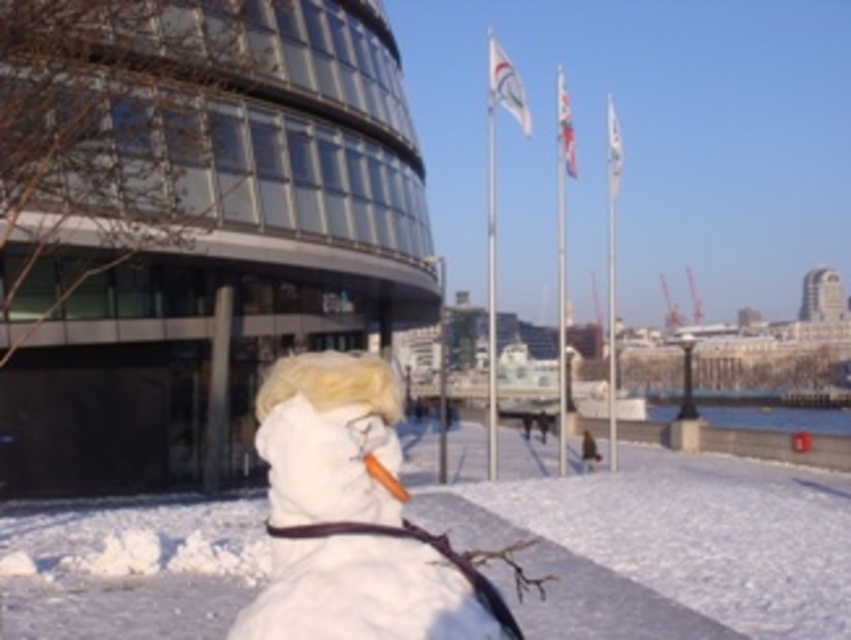
You are a photographer trying to capture both the white fluffy snowman at lower center and the white fluffy snowman at center in a single shot. Given that your camera can only focus on one snowman at a time, which snowman should you focus on first to ensure it appears larger in the photo?

You should focus on the white fluffy snowman at lower center first because it is larger in size than the white fluffy snowman at center, ensuring it will appear bigger in the photo.

You are standing at the camera position and want to take a photo of the white fluffy snowman at lower center. The camera has a maximum focus range of 12 meters. Will the snowman be in focus?

The white fluffy snowman at lower center is 13.10 meters away from the camera, which exceeds the maximum focus range of 12 meters. Therefore, the snowman will not be in focus.

You are a photographer trying to capture the snowman in the winter scene. You notice the white fluffy snowman at center and the blonde synthetic wig at center. Which object is closer to you, the photographer?

The white fluffy snowman at center is closer to you because it is in front of the blonde synthetic wig at center.